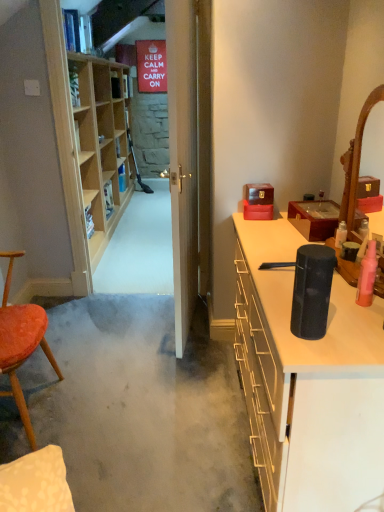
Question: Can you confirm if wooden mirror at right is thinner than wooden jewelry box at upper right, the second cabinetry positioned from the bottom?

Choices:
 (A) yes
 (B) no

Answer: (A)

Question: From a real-world perspective, is wooden mirror at right over wooden jewelry box at upper right, the second cabinetry positioned from the bottom?

Choices:
 (A) yes
 (B) no

Answer: (A)

Question: From a real-world perspective, is wooden mirror at right under wooden jewelry box at upper right, the second cabinetry positioned from the bottom?

Choices:
 (A) no
 (B) yes

Answer: (A)

Question: Is wooden mirror at right taller than wooden jewelry box at upper right, the second cabinetry positioned from the bottom?

Choices:
 (A) yes
 (B) no

Answer: (A)

Question: Is wooden mirror at right smaller than wooden jewelry box at upper right, the second cabinetry positioned from the bottom?

Choices:
 (A) no
 (B) yes

Answer: (A)

Question: Looking at the image, does black matte speaker at right, the second cabinetry positioned from the top, seem bigger or smaller compared to wooden mirror at right?

Choices:
 (A) small
 (B) big

Answer: (B)

Question: From a real-world perspective, relative to wooden mirror at right, is black matte speaker at right, the second cabinetry positioned from the top, vertically above or below?

Choices:
 (A) above
 (B) below

Answer: (B)

Question: Considering the positions of point (365, 452) and point (382, 86), is point (365, 452) closer or farther from the camera than point (382, 86)?

Choices:
 (A) farther
 (B) closer

Answer: (B)

Question: Relative to wooden mirror at right, is black matte speaker at right, the first cabinetry in the bottom-to-top sequence, in front or behind?

Choices:
 (A) behind
 (B) front

Answer: (B)

Question: From a real-world perspective, is velvet orange chair at left physically located above or below black matte speaker at right, the second cabinetry positioned from the top?

Choices:
 (A) below
 (B) above

Answer: (B)

Question: Is velvet orange chair at left wider or thinner than black matte speaker at right, the second cabinetry positioned from the top?

Choices:
 (A) wide
 (B) thin

Answer: (B)

Question: From the image's perspective, is velvet orange chair at left above or below black matte speaker at right, the second cabinetry positioned from the top?

Choices:
 (A) above
 (B) below

Answer: (A)

Question: In terms of height, does velvet orange chair at left look taller or shorter compared to black matte speaker at right, the first cabinetry in the bottom-to-top sequence?

Choices:
 (A) short
 (B) tall

Answer: (B)

Question: Based on their positions, is wooden mirror at right located to the left or right of black matte speaker at right, the first cabinetry in the bottom-to-top sequence?

Choices:
 (A) right
 (B) left

Answer: (A)

Question: Is wooden mirror at right in front of or behind black matte speaker at right, the first cabinetry in the bottom-to-top sequence, in the image?

Choices:
 (A) behind
 (B) front

Answer: (A)